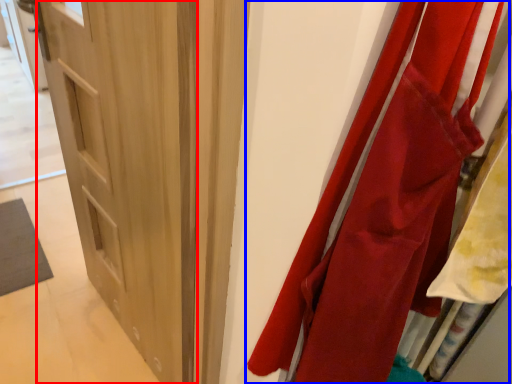
Question: Which object appears farthest to the camera in this image, door (highlighted by a red box) or curtain (highlighted by a blue box)?

Choices:
 (A) door
 (B) curtain

Answer: (A)